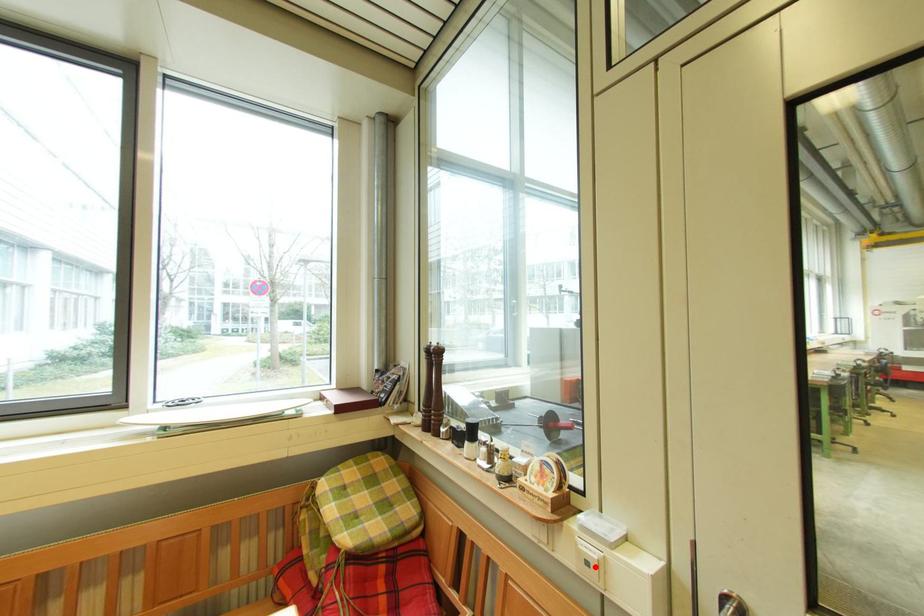
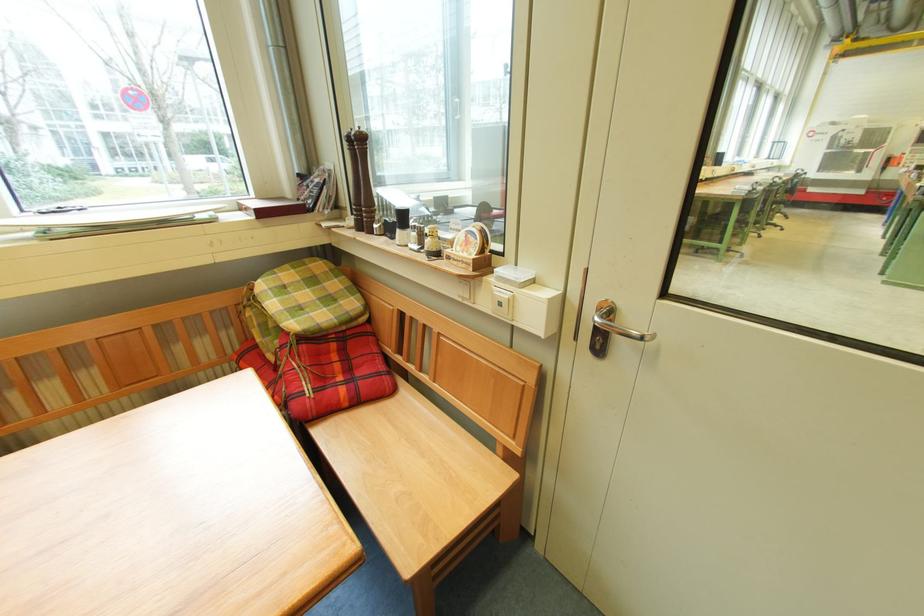
The point at the highlighted location is marked in the first image. Where is the corresponding point in the second image?

(507, 307)